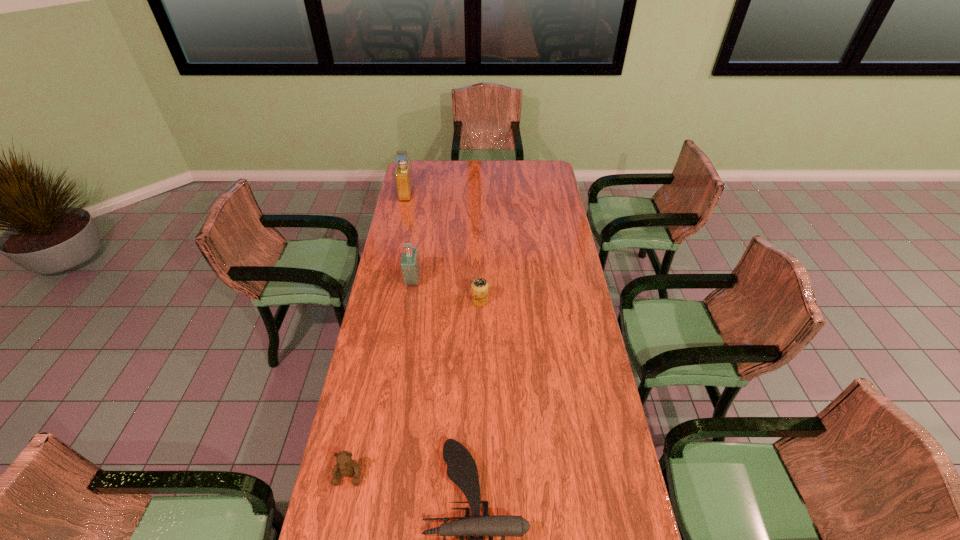
Image resolution: width=960 pixels, height=540 pixels. In order to click on the farther perfume in this screenshot , I will do `click(403, 175)`.

Locate an element on the screen. This screenshot has width=960, height=540. the tallest object is located at coordinates (403, 175).

Identify the location of the right perfume. (410, 268).

Identify the location of the fourth nearest object. (410, 268).

This screenshot has width=960, height=540. Find the location of `the third farthest object`. the third farthest object is located at coordinates (479, 287).

Where is `teddy bear`? teddy bear is located at coordinates (346, 466).

Locate an element on the screen. This screenshot has width=960, height=540. free region located 0.160m on the front-facing side of the farther perfume is located at coordinates (442, 193).

The height and width of the screenshot is (540, 960). What are the coordinates of `vacant space located 0.120m on the front label of the third object from right to left` in the screenshot? It's located at (448, 281).

Where is `free region located 0.300m on the right of the beer can`? free region located 0.300m on the right of the beer can is located at coordinates (562, 301).

Locate an element on the screen. This screenshot has width=960, height=540. vacant space situated 0.090m on the front-facing side of the teddy bear is located at coordinates (339, 521).